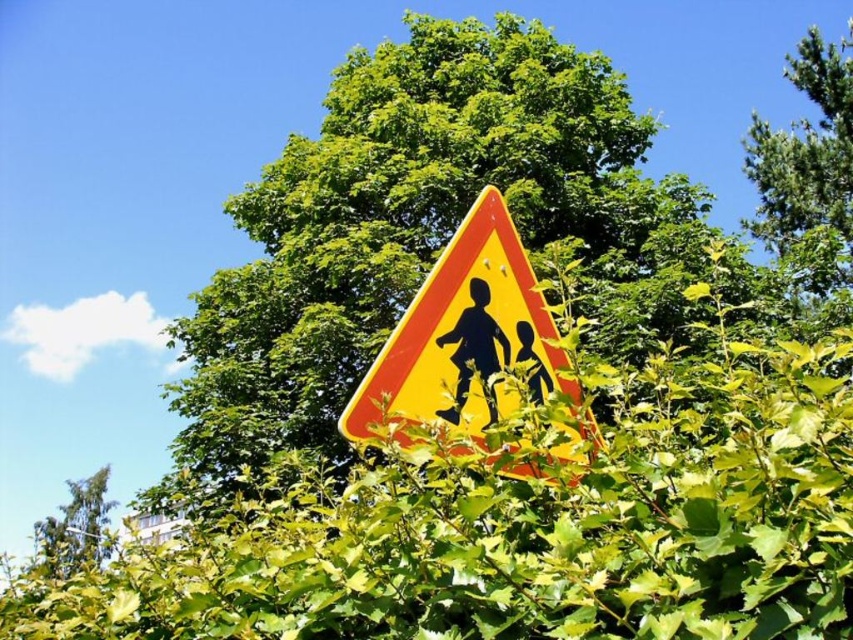
Question: Estimate the real-world distances between objects in this image. Which object is closer to the black silhouette at center?

Choices:
 (A) green leafy tree at center
 (B) green leafy tree at upper right
 (C) matte yellow sign at center
 (D) green leafy hedge at center

Answer: (C)

Question: Is yellow reflective triangle at center bigger than matte yellow sign at center?

Choices:
 (A) no
 (B) yes

Answer: (B)

Question: Is green leafy hedge at center above matte yellow sign at center?

Choices:
 (A) yes
 (B) no

Answer: (B)

Question: Among these objects, which one is nearest to the camera?

Choices:
 (A) green leafy tree at center
 (B) green leafy tree at upper center
 (C) green leafy tree at upper right

Answer: (A)

Question: Is green leafy tree at center positioned behind yellow reflective triangle at center?

Choices:
 (A) yes
 (B) no

Answer: (A)

Question: Based on their relative distances, which object is farther from the yellow reflective triangle at center?

Choices:
 (A) green leafy hedge at center
 (B) matte yellow sign at center

Answer: (A)